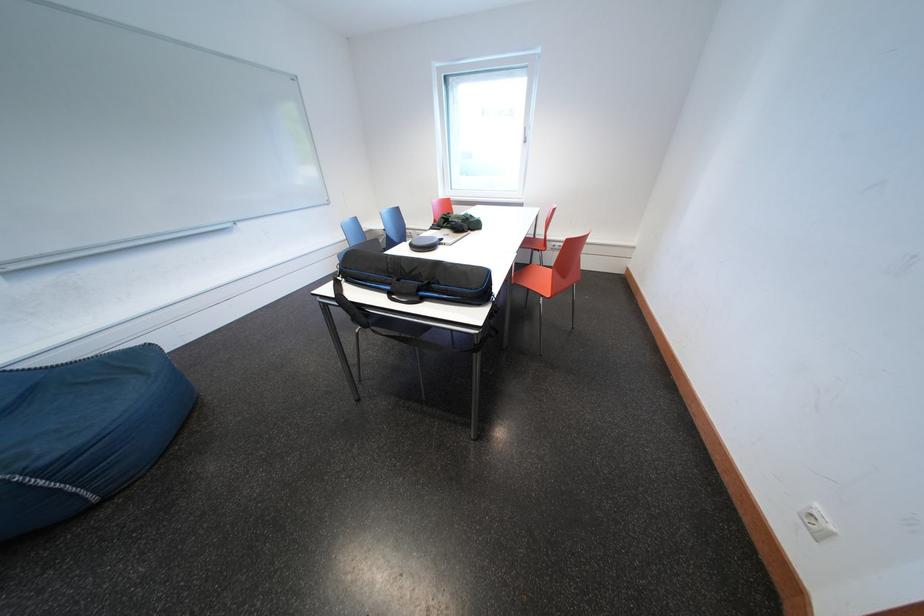
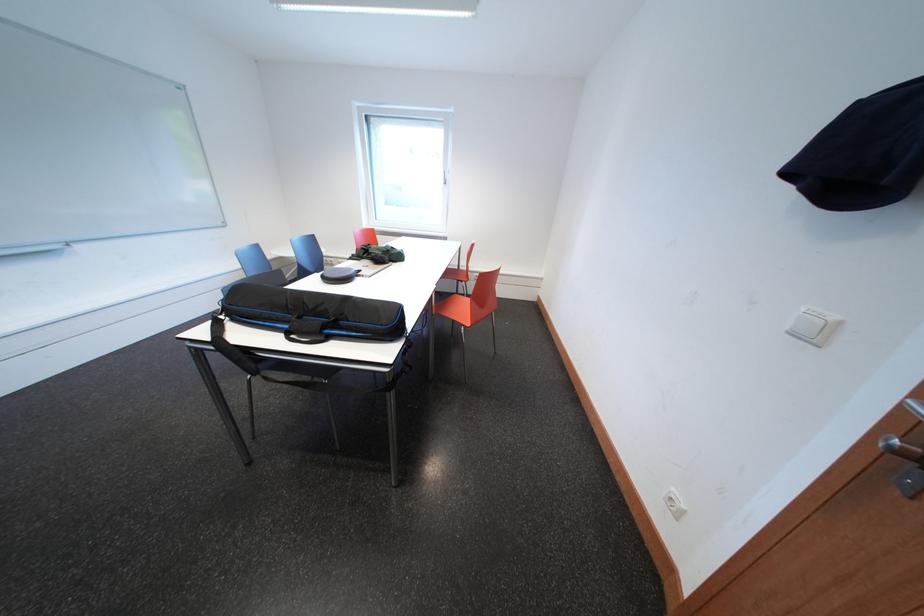
Question: What movement of the cameraman would produce the second image?

Choices:
 (A) Left
 (B) Right
 (C) Forward
 (D) Backward

Answer: (B)